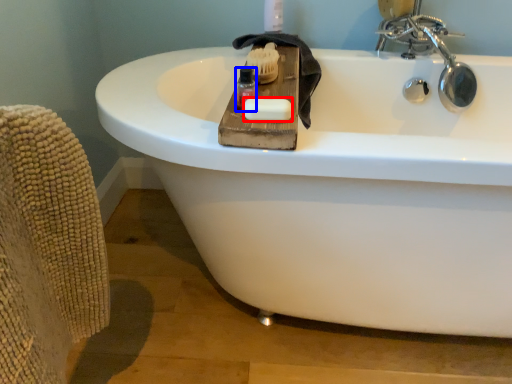
Question: Which of the following is the farthest to the observer, soap (highlighted by a red box) or mouthwash (highlighted by a blue box)?

Choices:
 (A) soap
 (B) mouthwash

Answer: (B)